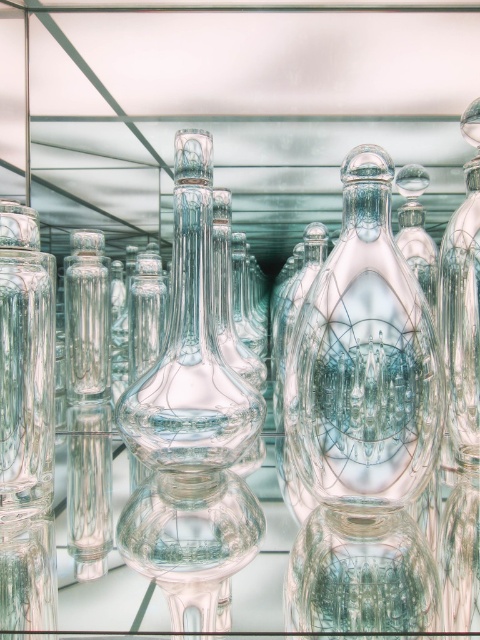
Is transparent glass vase at center to the left of transparent glass bottle at right from the viewer's perspective?

Correct, you'll find transparent glass vase at center to the left of transparent glass bottle at right.

Does transparent glass vase at center have a larger size compared to transparent glass bottle at right?

Actually, transparent glass vase at center might be smaller than transparent glass bottle at right.

Which is behind, point (348, 436) or point (458, 346)?

The point (458, 346) is more distant.

Find the location of `transparent glass vase at center`. transparent glass vase at center is located at coordinates (363, 358).